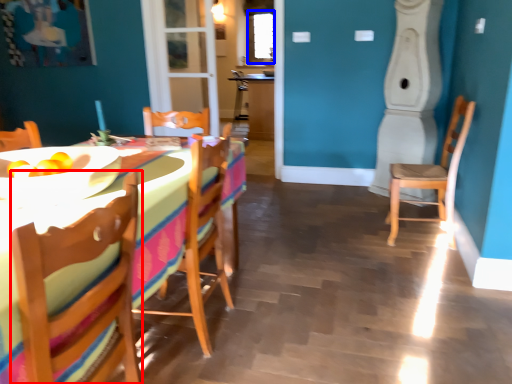
Question: Which of the following is the closest to the observer, chair (highlighted by a red box) or window screen (highlighted by a blue box)?

Choices:
 (A) chair
 (B) window screen

Answer: (A)